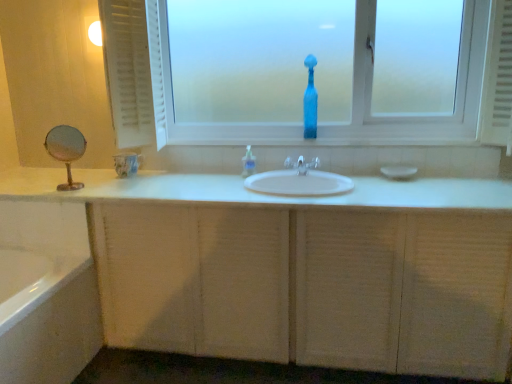
Question: Relative to transparent glass bottle at center, is white textured radiator at right in front or behind?

Choices:
 (A) front
 (B) behind

Answer: (A)

Question: In the image, is white textured radiator at right on the left side or the right side of transparent glass bottle at center?

Choices:
 (A) left
 (B) right

Answer: (B)

Question: Estimate the real-world distances between objects in this image. Which object is closer to the white textured cabinet at center?

Choices:
 (A) white matte curtain at left
 (B) white matte soap at center
 (C) translucent glass vase at center
 (D) white textured radiator at right
 (E) translucent plastic soap dispenser at center

Answer: (E)

Question: Estimate the real-world distances between objects in this image. Which object is closer to the transparent glass bottle at center?

Choices:
 (A) white matte soap at center
 (B) metallic reflective mirror at left
 (C) white matte curtain at left
 (D) translucent plastic soap dispenser at center
 (E) clear plastic faucet at center

Answer: (C)